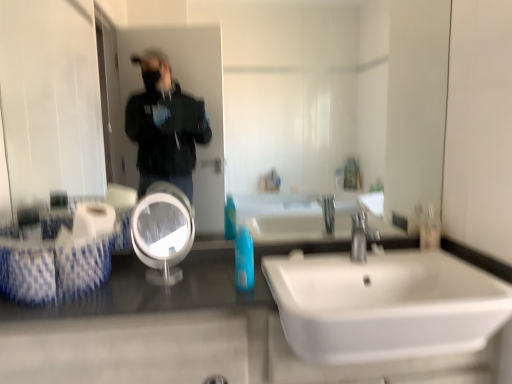
Identify the location of vacant space that is to the left of satin nickel faucet at center. (318, 262).